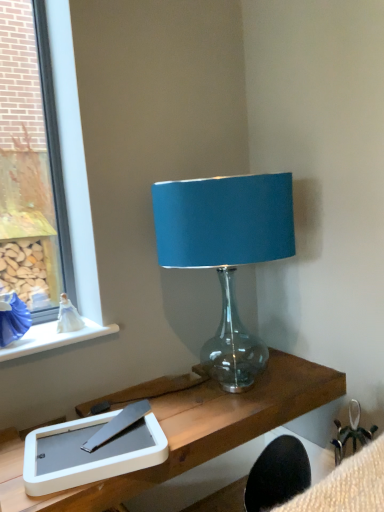
Question: Does white matte tablet at lower left have a greater width compared to clear glass window at left?

Choices:
 (A) yes
 (B) no

Answer: (A)

Question: From a real-world perspective, is white matte tablet at lower left on top of clear glass window at left?

Choices:
 (A) no
 (B) yes

Answer: (A)

Question: Is white matte tablet at lower left closer to camera compared to clear glass window at left?

Choices:
 (A) no
 (B) yes

Answer: (B)

Question: Does white matte tablet at lower left appear on the left side of clear glass window at left?

Choices:
 (A) no
 (B) yes

Answer: (A)

Question: From a real-world perspective, is white matte tablet at lower left under clear glass window at left?

Choices:
 (A) yes
 (B) no

Answer: (A)

Question: Is white matte tablet at lower left bigger than clear glass window at left?

Choices:
 (A) no
 (B) yes

Answer: (A)

Question: Is white matte tablet at lower left bigger than teal fabric lampshade at upper center?

Choices:
 (A) yes
 (B) no

Answer: (B)

Question: Is white matte tablet at lower left located outside teal fabric lampshade at upper center?

Choices:
 (A) no
 (B) yes

Answer: (B)

Question: From the image's perspective, does white matte tablet at lower left appear higher than teal fabric lampshade at upper center?

Choices:
 (A) yes
 (B) no

Answer: (B)

Question: Is white matte tablet at lower left next to teal fabric lampshade at upper center?

Choices:
 (A) yes
 (B) no

Answer: (B)

Question: Does white matte tablet at lower left turn towards teal fabric lampshade at upper center?

Choices:
 (A) yes
 (B) no

Answer: (B)

Question: Can you confirm if white matte tablet at lower left is wider than teal fabric lampshade at upper center?

Choices:
 (A) yes
 (B) no

Answer: (B)

Question: Considering the relative sizes of teal fabric lampshade at upper center and clear glass window at left in the image provided, is teal fabric lampshade at upper center bigger than clear glass window at left?

Choices:
 (A) yes
 (B) no

Answer: (A)